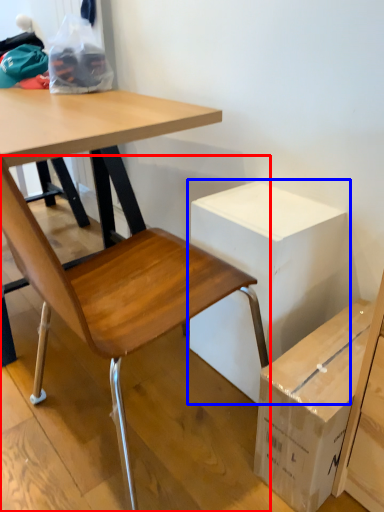
Question: Which object is closer to the camera taking this photo, chair (highlighted by a red box) or cardboard box (highlighted by a blue box)?

Choices:
 (A) chair
 (B) cardboard box

Answer: (A)